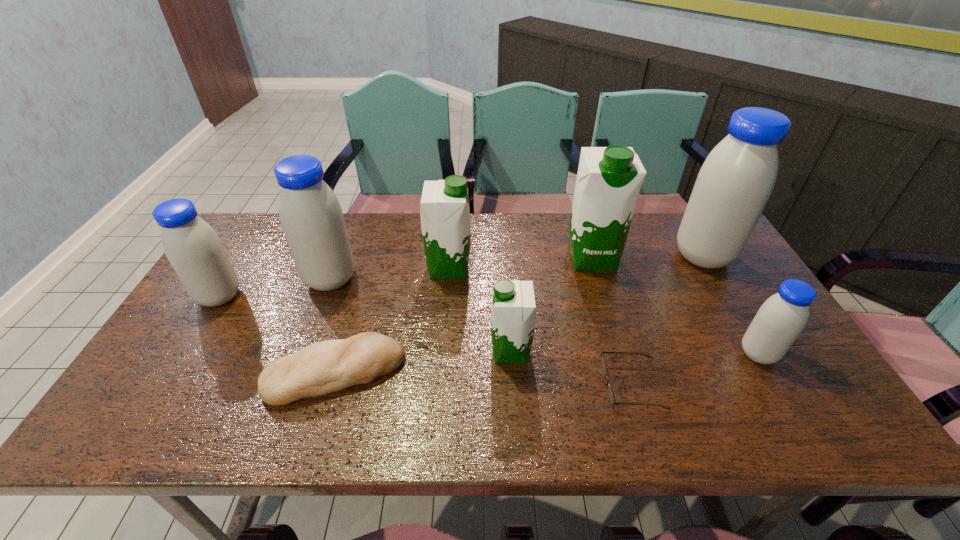
Image resolution: width=960 pixels, height=540 pixels. In order to click on spectacles situated at the near edge in this screenshot , I will do `click(603, 363)`.

You are a GUI agent. You are given a task and a screenshot of the screen. Output one action in this format:
    pyautogui.click(x=<x>, y=<y>)
    Task: Click on the object that is at the left edge
    Image resolution: width=960 pixels, height=540 pixels.
    Given the screenshot: What is the action you would take?
    pyautogui.click(x=193, y=248)

Find the location of a particular element. Image resolution: width=960 pixels, height=540 pixels. object at the far right corner is located at coordinates (737, 178).

Locate an element on the screen. This screenshot has height=540, width=960. free location at the far edge of the desktop is located at coordinates (420, 239).

Where is `vacant space at the near edge`? vacant space at the near edge is located at coordinates (463, 406).

At what (x,y) coordinates should I click in order to perform the action: click on free space at the left edge. Please return your answer as a coordinate pair (x, y). The width and height of the screenshot is (960, 540). Looking at the image, I should click on (152, 383).

The height and width of the screenshot is (540, 960). Identify the location of vacant area at the right edge of the desktop. (719, 300).

In the image, there is a desktop. Where is `vacant space at the far left corner`? This screenshot has height=540, width=960. vacant space at the far left corner is located at coordinates (265, 213).

Where is `free space at the near left corner of the desktop`? This screenshot has width=960, height=540. free space at the near left corner of the desktop is located at coordinates (160, 431).

Where is `vacant area that lies between the third soya milk from left to right and the nearest blue soya milk`? vacant area that lies between the third soya milk from left to right and the nearest blue soya milk is located at coordinates (604, 311).